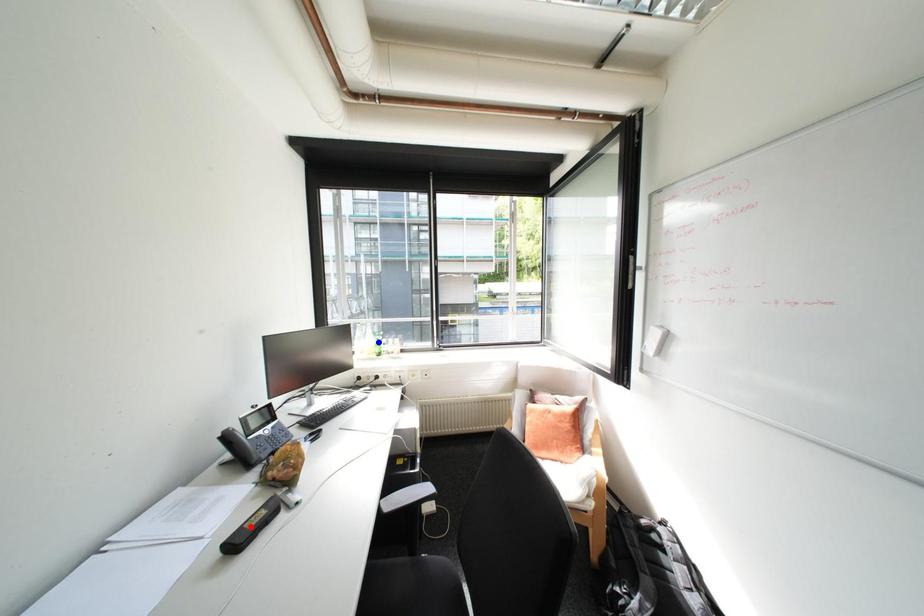
Question: In the image, two points are highlighted. Which point is nearer to the camera? Reply with the corresponding letter.

Choices:
 (A) blue point
 (B) red point

Answer: (B)